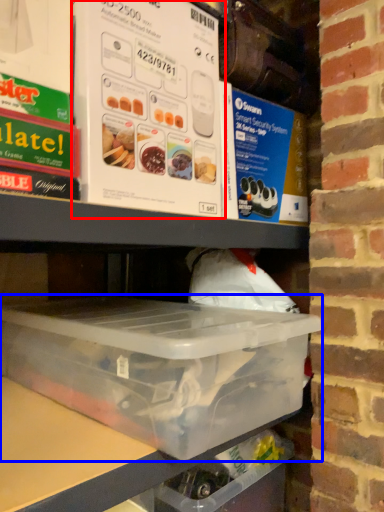
Question: Which object is closer to the camera taking this photo, box (highlighted by a red box) or box (highlighted by a blue box)?

Choices:
 (A) box
 (B) box

Answer: (B)